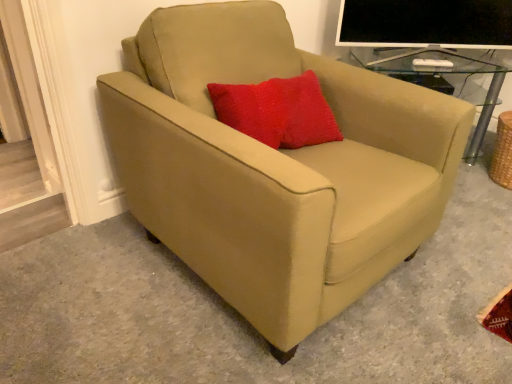
What do you see at coordinates (425, 25) in the screenshot? The image size is (512, 384). I see `matte black monitor at upper right` at bounding box center [425, 25].

Image resolution: width=512 pixels, height=384 pixels. Find the location of `matte black monitor at upper right`. matte black monitor at upper right is located at coordinates (425, 25).

What is the approximate height of suede beige armchair at center?

suede beige armchair at center is 32.15 inches in height.

What is the approximate width of suede beige armchair at center?

The width of suede beige armchair at center is 37.97 inches.

This screenshot has height=384, width=512. Describe the element at coordinates (276, 166) in the screenshot. I see `suede beige armchair at center` at that location.

At what (x,y) coordinates should I click in order to perform the action: click on suede beige armchair at center. Please return your answer as a coordinate pair (x, y). Looking at the image, I should click on (276, 166).

The width and height of the screenshot is (512, 384). I want to click on matte black monitor at upper right, so click(425, 25).

Does suede beige armchair at center appear on the right side of matte black monitor at upper right?

Incorrect, suede beige armchair at center is not on the right side of matte black monitor at upper right.

Is suede beige armchair at center in front of or behind matte black monitor at upper right in the image?

In the image, suede beige armchair at center appears in front of matte black monitor at upper right.

Which is nearer, (x=152, y=33) or (x=484, y=0)?

Clearly, point (x=152, y=33) is closer to the camera than point (x=484, y=0).

From the image's perspective, which one is positioned higher, suede beige armchair at center or matte black monitor at upper right?

matte black monitor at upper right, from the image's perspective.

From a real-world perspective, who is located lower, suede beige armchair at center or matte black monitor at upper right?

suede beige armchair at center.

Is suede beige armchair at center thinner than matte black monitor at upper right?

In fact, suede beige armchair at center might be wider than matte black monitor at upper right.

From their relative heights in the image, would you say suede beige armchair at center is taller or shorter than matte black monitor at upper right?

Clearly, suede beige armchair at center is taller compared to matte black monitor at upper right.

Considering the sizes of objects suede beige armchair at center and matte black monitor at upper right in the image provided, who is bigger, suede beige armchair at center or matte black monitor at upper right?

suede beige armchair at center is bigger.

Would you say suede beige armchair at center contains matte black monitor at upper right?

No.

Is suede beige armchair at center placed right next to matte black monitor at upper right?

suede beige armchair at center and matte black monitor at upper right are clearly separated.

Is suede beige armchair at center facing towards matte black monitor at upper right?

No, suede beige armchair at center is not turned towards matte black monitor at upper right.

Can you tell me how much suede beige armchair at center and matte black monitor at upper right differ in facing direction?

37.2 degrees separate the facing orientations of suede beige armchair at center and matte black monitor at upper right.

At what (x,y) coordinates should I click in order to perform the action: click on chair lying in front of the matte black monitor at upper right. Please return your answer as a coordinate pair (x, y). The height and width of the screenshot is (384, 512). Looking at the image, I should click on (276, 166).

Does matte black monitor at upper right appear on the right side of suede beige armchair at center?

Yes.

Between matte black monitor at upper right and suede beige armchair at center, which one is positioned in front?

suede beige armchair at center is in front.

Which is in front, point (477, 26) or point (200, 9)?

The point (200, 9) is in front.

From the image's perspective, relative to suede beige armchair at center, is matte black monitor at upper right above or below?

Based on their image positions, matte black monitor at upper right is located above suede beige armchair at center.

From a real-world perspective, which is physically below, matte black monitor at upper right or suede beige armchair at center?

suede beige armchair at center, from a real-world perspective.

In terms of width, does matte black monitor at upper right look wider or thinner when compared to suede beige armchair at center?

Clearly, matte black monitor at upper right has less width compared to suede beige armchair at center.

Which of these two, matte black monitor at upper right or suede beige armchair at center, stands taller?

Standing taller between the two is suede beige armchair at center.

Considering the relative sizes of matte black monitor at upper right and suede beige armchair at center in the image provided, is matte black monitor at upper right bigger than suede beige armchair at center?

No, matte black monitor at upper right is not bigger than suede beige armchair at center.

Is matte black monitor at upper right not inside suede beige armchair at center?

Absolutely, matte black monitor at upper right is external to suede beige armchair at center.

Are matte black monitor at upper right and suede beige armchair at center located far from each other?

matte black monitor at upper right is near suede beige armchair at center, not far away.

Could you tell me if matte black monitor at upper right is facing suede beige armchair at center?

No, matte black monitor at upper right is not facing towards suede beige armchair at center.

Find the location of `computer monitor to the right of suede beige armchair at center`. computer monitor to the right of suede beige armchair at center is located at coordinates (425, 25).

You are a GUI agent. You are given a task and a screenshot of the screen. Output one action in this format:
    pyautogui.click(x=<x>, y=<y>)
    Task: Click on the computer monitor located behind the suede beige armchair at center
    The width and height of the screenshot is (512, 384).
    Given the screenshot: What is the action you would take?
    pyautogui.click(x=425, y=25)

Where is `chair below the matte black monitor at upper right (from a real-world perspective)`? chair below the matte black monitor at upper right (from a real-world perspective) is located at coordinates (276, 166).